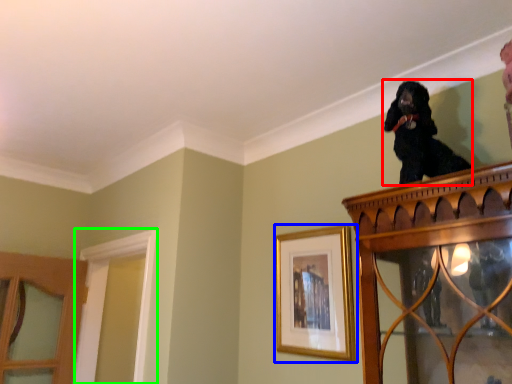
Question: Which object is positioned farthest from dog (highlighted by a red box)? Select from picture frame (highlighted by a blue box) and window frame (highlighted by a green box).

Choices:
 (A) picture frame
 (B) window frame

Answer: (B)